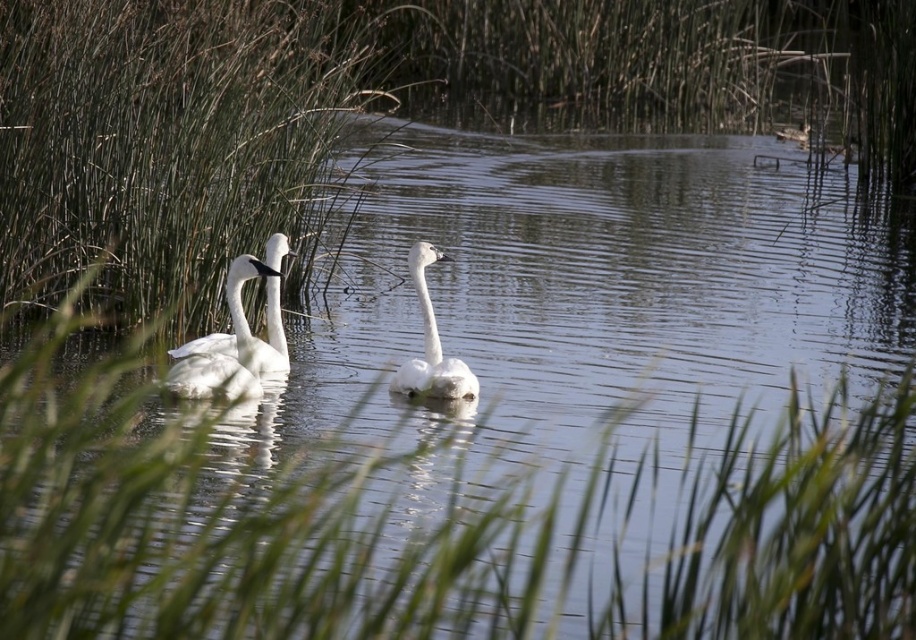
Question: Based on their relative distances, which object is farther from the green grass at upper left?

Choices:
 (A) white glossy swan at left
 (B) white matte swan at center

Answer: (B)

Question: Which point is closer to the camera taking this photo?

Choices:
 (A) (97, 170)
 (B) (422, 310)
 (C) (266, 273)

Answer: (C)

Question: Does green grass at upper left lie behind white glossy swan at left?

Choices:
 (A) no
 (B) yes

Answer: (B)

Question: Among these objects, which one is farthest from the camera?

Choices:
 (A) white matte swan at center
 (B) green grass at upper left
 (C) white glossy swan at left

Answer: (B)

Question: Does green grass at upper left appear over white matte swan at center?

Choices:
 (A) yes
 (B) no

Answer: (A)

Question: Can you confirm if green grass at upper left is positioned to the right of white matte swan at center?

Choices:
 (A) yes
 (B) no

Answer: (B)